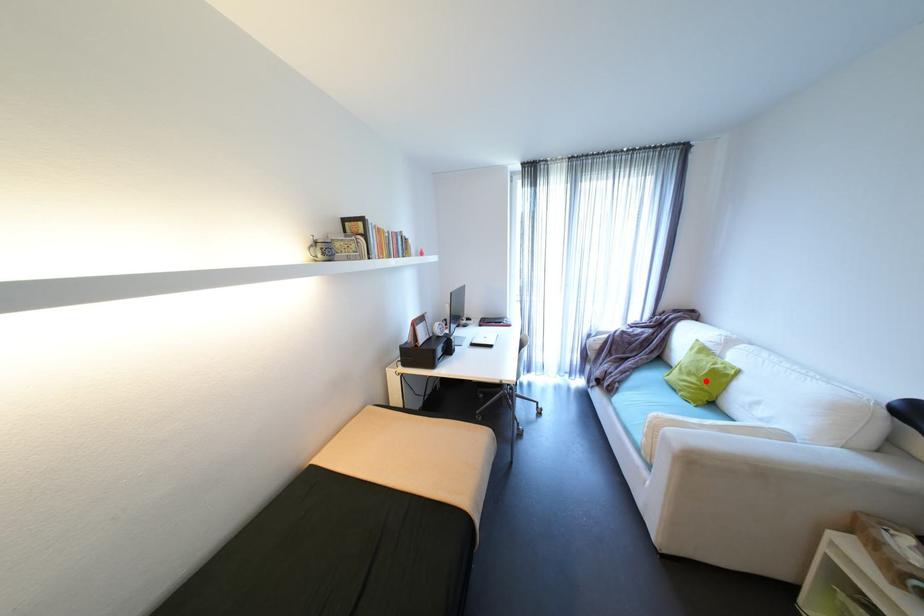
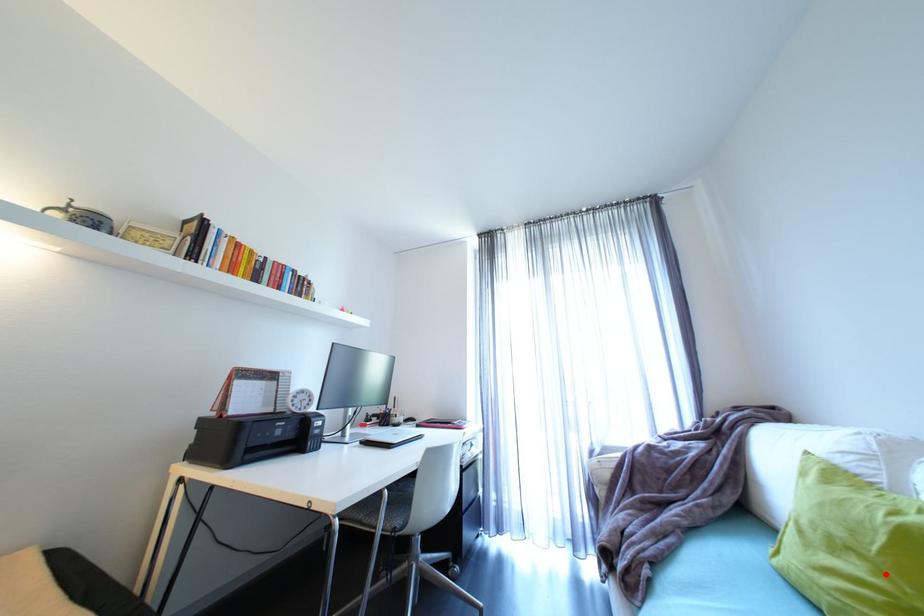
I am providing you with two images of the same scene from different viewpoints. A red point is marked on the first image and another point is marked on the second image. Does the point marked in image1 correspond to the same location as the one in image2?

Yes